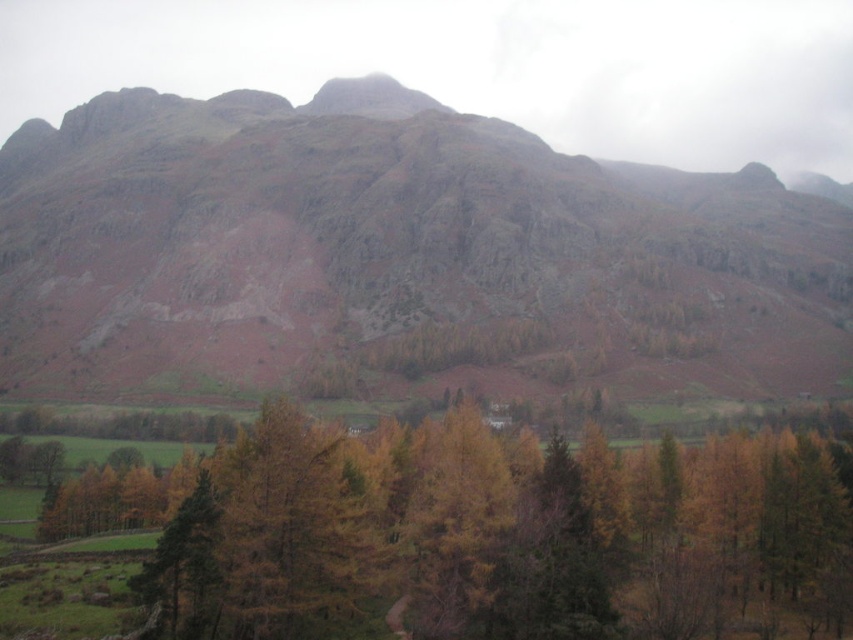
Consider the image. You are a hiker standing at the base of the mountain and see two points marked on the map. The first point is at coordinates point (257, 115) and the second is at point (268, 580). Which point is closer to your current position?

Point (257, 115) is closer to your current position because it is further to the viewer than point (268, 580), which is farther away.